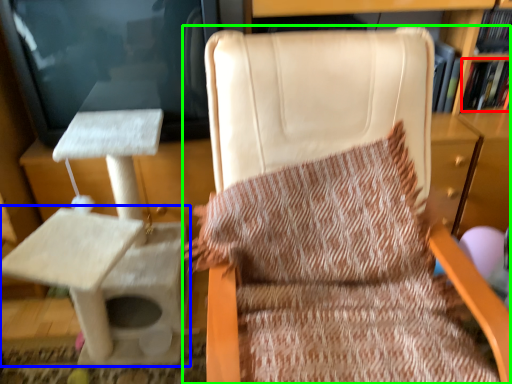
Question: Based on their relative distances, which object is farther from book (highlighted by a red box)? Choose from table (highlighted by a blue box) and chair (highlighted by a green box).

Choices:
 (A) table
 (B) chair

Answer: (A)